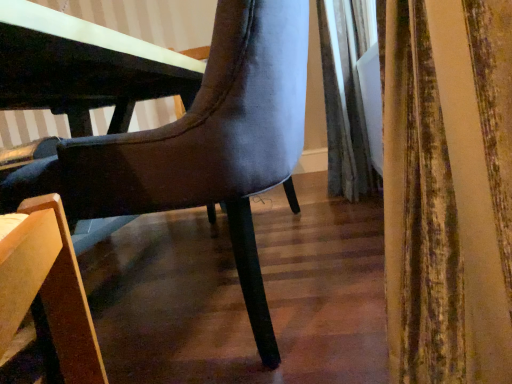
Question: Is velvet gray curtain at right wider or thinner than suede-like gray chair at center?

Choices:
 (A) wide
 (B) thin

Answer: (B)

Question: Considering the positions of point (345, 195) and point (269, 76), is point (345, 195) closer or farther from the camera than point (269, 76)?

Choices:
 (A) farther
 (B) closer

Answer: (A)

Question: From the image's perspective, relative to suede-like gray chair at center, is velvet gray curtain at right above or below?

Choices:
 (A) below
 (B) above

Answer: (B)

Question: Relative to velvet gray curtain at right, is suede-like gray chair at center in front or behind?

Choices:
 (A) front
 (B) behind

Answer: (A)

Question: Is point (216, 198) closer or farther from the camera than point (327, 44)?

Choices:
 (A) closer
 (B) farther

Answer: (A)

Question: Looking at the image, does suede-like gray chair at center seem bigger or smaller compared to velvet gray curtain at right?

Choices:
 (A) small
 (B) big

Answer: (B)

Question: Based on their positions, is suede-like gray chair at center located to the left or right of velvet gray curtain at right?

Choices:
 (A) left
 (B) right

Answer: (A)